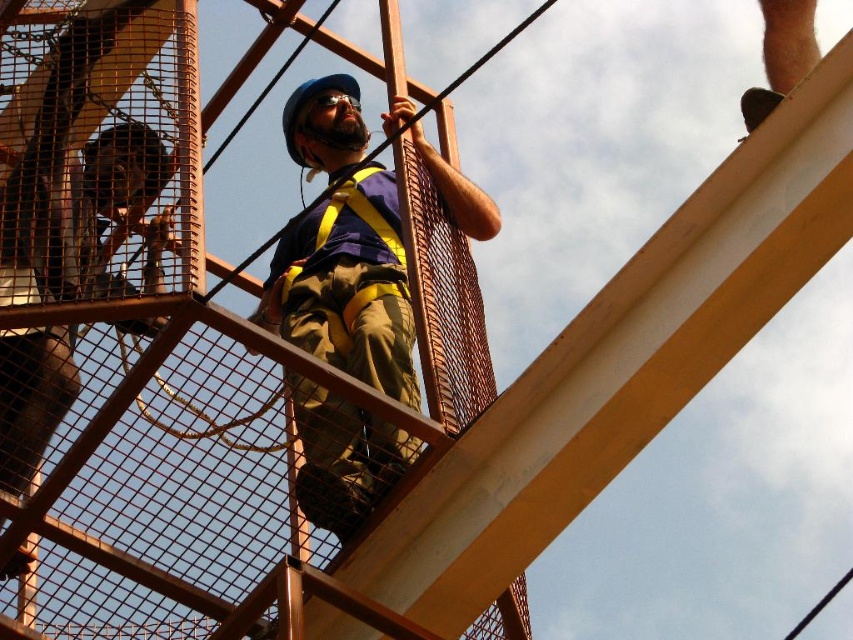
You are a safety inspector assessing the distance between the matte blue helmet at center and the matte yellow safety vest at center in the image. The safety regulations require that these two items must be within 3 meters of each other for proper visibility. Is the current distance compliant with the regulations?

The matte blue helmet at center and matte yellow safety vest at center are 3.25 meters apart, which exceeds the 3 meter requirement. Therefore, the current distance is not compliant with the safety regulations.

Looking at this image, you are a safety inspector assessing the construction site depicted in the image. You notice the matte blue helmet at center and the matte yellow safety vest at center. Which object would you recommend replacing if there is a shortage of materials for the larger item?

The matte blue helmet at center has a larger size compared to the matte yellow safety vest at center, so if there is a shortage of materials, the matte blue helmet at center would require more resources and should be prioritized for replacement.

You are a safety inspector observing the construction site. You notice the matte blue helmet at center and the matte yellow safety vest at center. Which object is taller in the image?

The matte blue helmet at center is taller than the matte yellow safety vest at center.